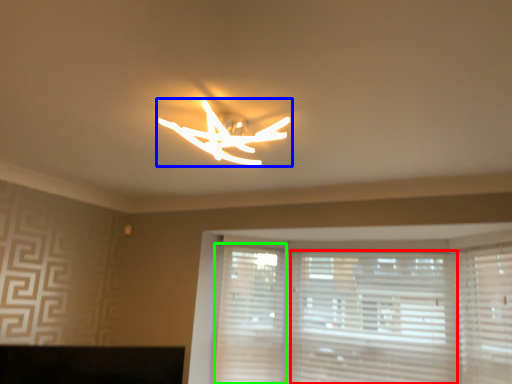
Question: Which object is positioned closest to blind (highlighted by a red box)? Select from lamp (highlighted by a blue box) and shutter (highlighted by a green box).

Choices:
 (A) lamp
 (B) shutter

Answer: (B)